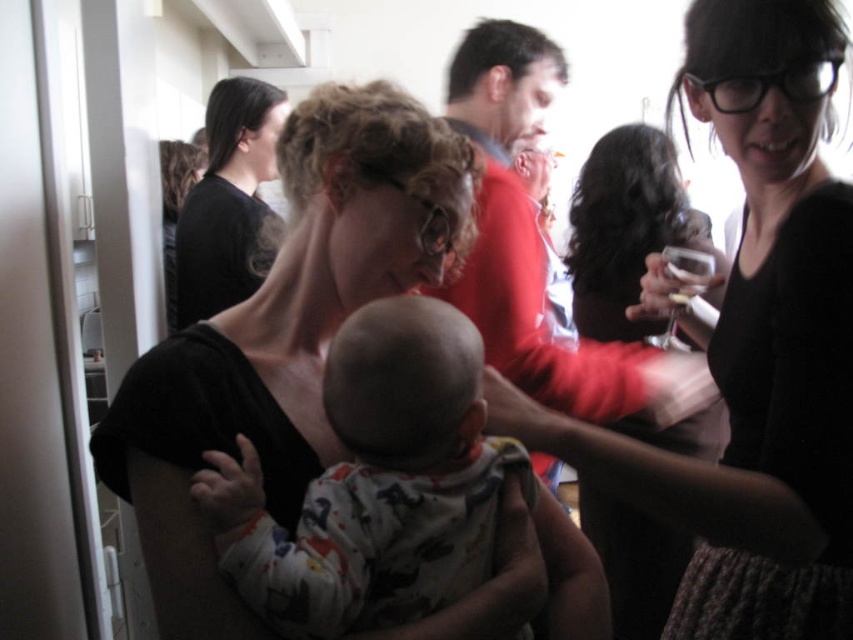
Does black matte shirt at center appear on the right side of white cotton onesie at center?

No, black matte shirt at center is not to the right of white cotton onesie at center.

Between black matte shirt at center and white cotton onesie at center, which one is positioned higher?

black matte shirt at center is above.

Identify the location of black matte shirt at center. This screenshot has height=640, width=853. (283, 337).

From the picture: Is black textured dress at upper right bigger than white cotton onesie at center?

Correct, black textured dress at upper right is larger in size than white cotton onesie at center.

Can you confirm if black textured dress at upper right is positioned above white cotton onesie at center?

Indeed, black textured dress at upper right is positioned over white cotton onesie at center.

Who is more forward, [759,588] or [323,483]?

Point [323,483] is in front.

Locate an element on the screen. The image size is (853, 640). black textured dress at upper right is located at coordinates (752, 362).

Is black textured dress at upper right below black matte shirt at upper left?

Indeed, black textured dress at upper right is positioned under black matte shirt at upper left.

This screenshot has height=640, width=853. Describe the element at coordinates (752, 362) in the screenshot. I see `black textured dress at upper right` at that location.

Does point (769, 58) come behind point (194, 250)?

No.

This screenshot has width=853, height=640. What are the coordinates of `black textured dress at upper right` in the screenshot? It's located at (752, 362).